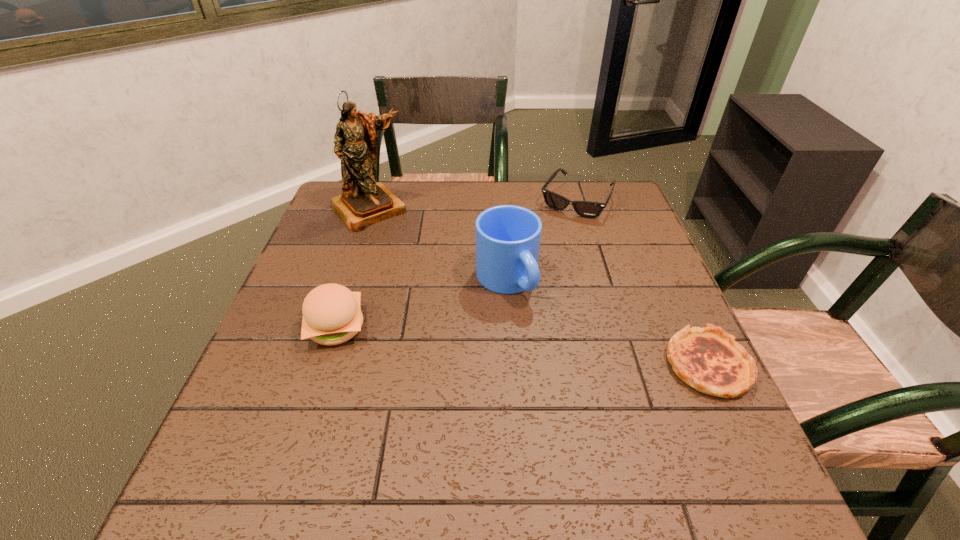
The image size is (960, 540). In order to click on free space located 0.080m on the front-facing side of the figurine in this screenshot , I will do `click(399, 242)`.

What are the coordinates of `vacant region located on the side of the mug with the handle` in the screenshot? It's located at (578, 373).

Where is `free location located on the side of the mug with the handle`? This screenshot has height=540, width=960. free location located on the side of the mug with the handle is located at coordinates (590, 388).

Where is `blank space located 0.060m on the side of the mug with the handle`? This screenshot has height=540, width=960. blank space located 0.060m on the side of the mug with the handle is located at coordinates (537, 323).

This screenshot has height=540, width=960. Find the location of `vacant space positioned on the front-facing side of the fourth tallest object`. vacant space positioned on the front-facing side of the fourth tallest object is located at coordinates (557, 230).

Identify the location of free space located 0.060m on the front-facing side of the fourth tallest object. This screenshot has width=960, height=540. (557, 230).

The image size is (960, 540). In order to click on blank area located 0.270m on the front-facing side of the fourth tallest object in this screenshot , I will do `click(529, 275)`.

Image resolution: width=960 pixels, height=540 pixels. I want to click on figurine present at the far edge, so click(364, 202).

The height and width of the screenshot is (540, 960). In order to click on sunglasses positioned at the far edge in this screenshot , I will do `click(587, 209)`.

Locate an element on the screen. hamburger at the left edge is located at coordinates (332, 315).